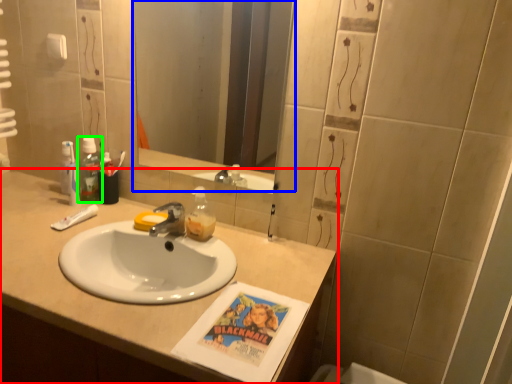
Question: Which is nearer to the bathroom cabinet (highlighted by a red box)? mirror (highlighted by a blue box) or mouthwash (highlighted by a green box).

Choices:
 (A) mirror
 (B) mouthwash

Answer: (B)